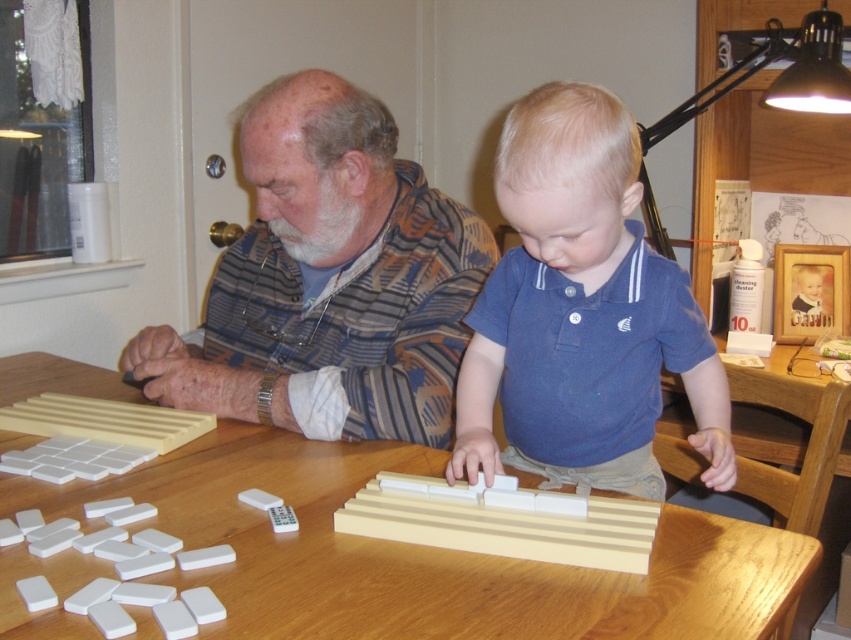
Question: Which of these objects is positioned farthest from the blue cotton shirt at center?

Choices:
 (A) striped fabric shirt at center
 (B) wooden table at center

Answer: (A)

Question: In this image, where is striped fabric shirt at center located relative to blue cotton shirt at center?

Choices:
 (A) left
 (B) right

Answer: (A)

Question: Which point is closer to the camera?

Choices:
 (A) striped fabric shirt at center
 (B) wooden table at center
 (C) blue cotton shirt at center

Answer: (B)

Question: Among these points, which one is nearest to the camera?

Choices:
 (A) (263, 611)
 (B) (346, 339)
 (C) (634, 177)

Answer: (A)

Question: Does striped fabric shirt at center come in front of blue cotton shirt at center?

Choices:
 (A) no
 (B) yes

Answer: (A)

Question: Can you confirm if wooden table at center is bigger than blue cotton shirt at center?

Choices:
 (A) no
 (B) yes

Answer: (B)